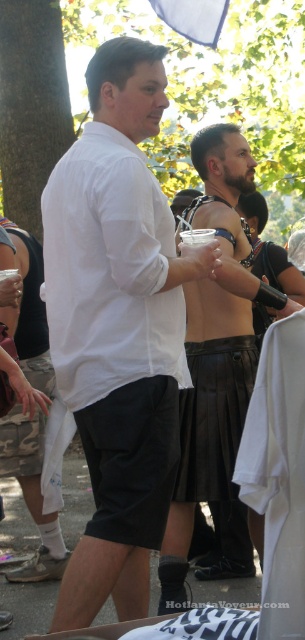
You are at the center of the scene and need to hand a small item to the person wearing the white matte shirt at center. In which direction should you move to reach them?

Since the white matte shirt at center is located at point [118,326], you should move towards the center of the scene to reach them.

Looking at this image, you are organizing a costume party and need to arrange two outfits displayed in the center of the room. The outfits are the white matte shirt at center and the leather kilt at center. According to the scene, which outfit is placed to the left?

The white matte shirt at center is positioned on the left side of the leather kilt at center, so the white matte shirt at center is the one placed to the left.

You are a photographer trying to capture a candid shot of both the white cotton shirt at center and the leather kilt at center in the same frame. Based on their positions, which one should you focus on first to ensure both are in the frame?

The white cotton shirt at center is positioned on the left side of the leather kilt at center, so you should focus on the white cotton shirt at center first to ensure both are included in the frame.